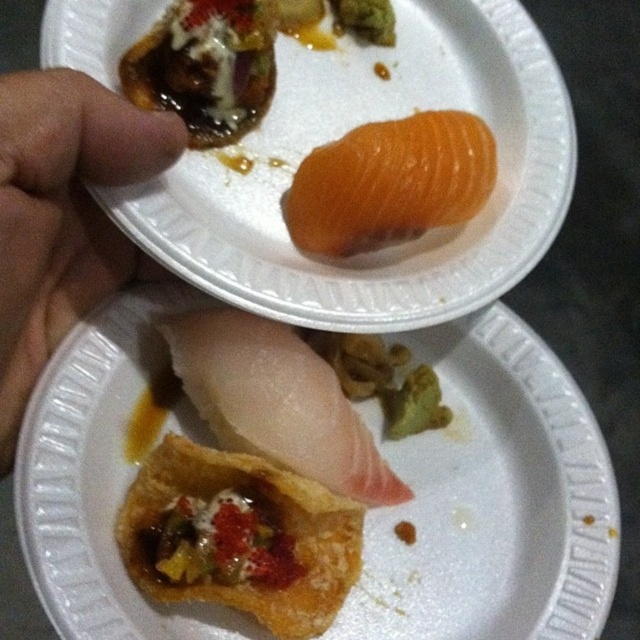
You are a food critic standing 24 inches away from the table. You notice the crusty fried pastry at center. Can you reach it without moving your chair?

The crusty fried pastry at center is 25.23 inches away from the viewer, so you are 1.23 inches too far to reach it without moving your chair.

Looking at this image, you are at a Japanese restaurant and see two dishes on your plate. One is a crusty fried pastry at center and the other is a white raw fish at center. Which dish is positioned to the left side of the plate?

The crusty fried pastry at center is positioned to the left of the white raw fish at center.